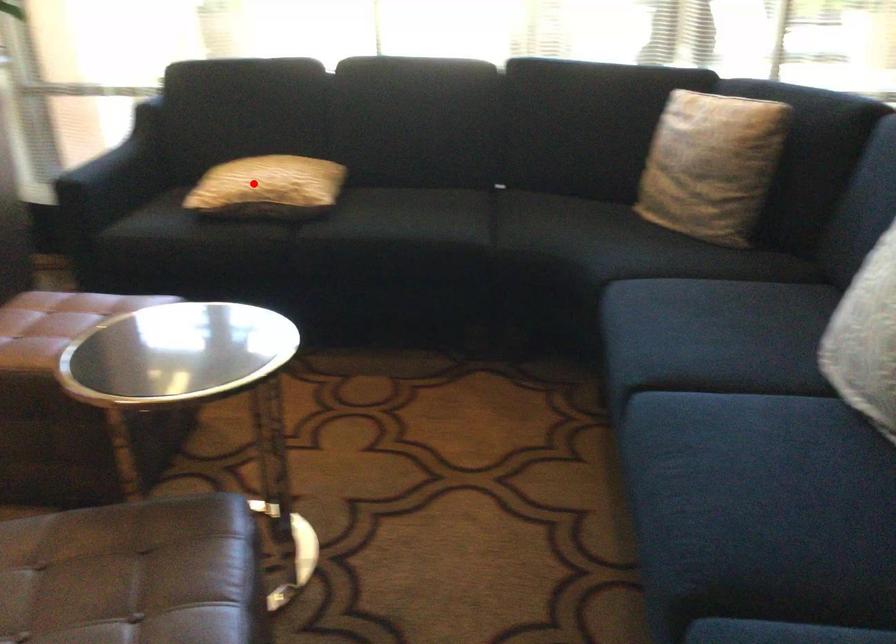
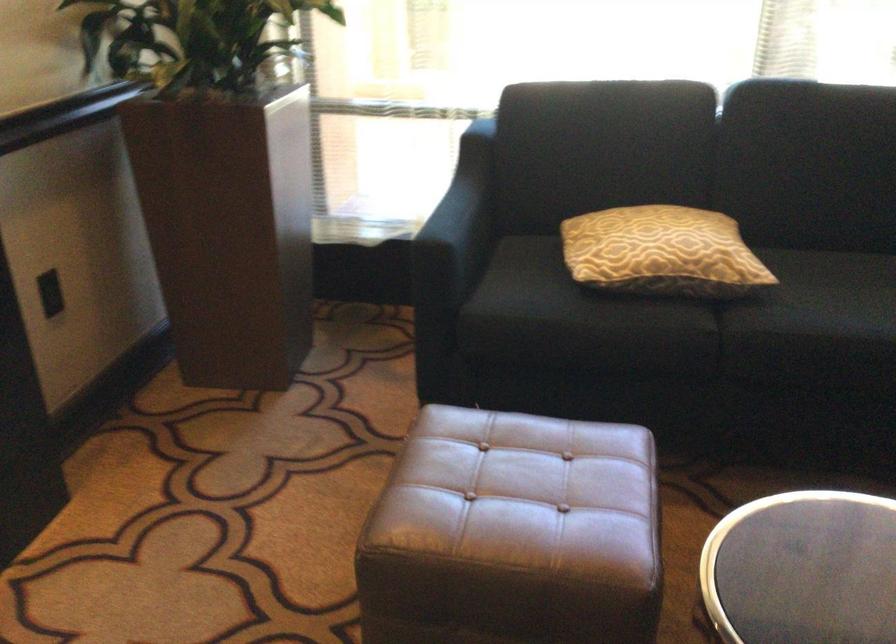
Where in the second image is the point corresponding to the highlighted location from the first image?

(661, 252)